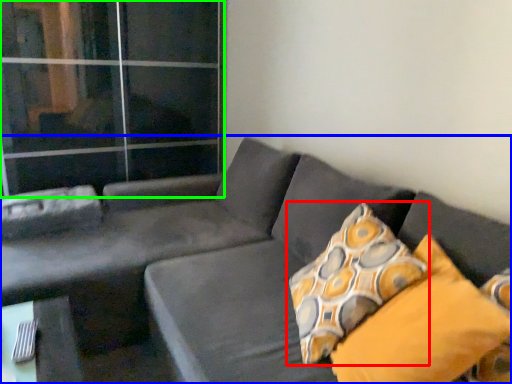
Question: Considering the real-world distances, which object is farthest from pillow (highlighted by a red box)? studio couch (highlighted by a blue box) or glass door (highlighted by a green box)?

Choices:
 (A) studio couch
 (B) glass door

Answer: (B)